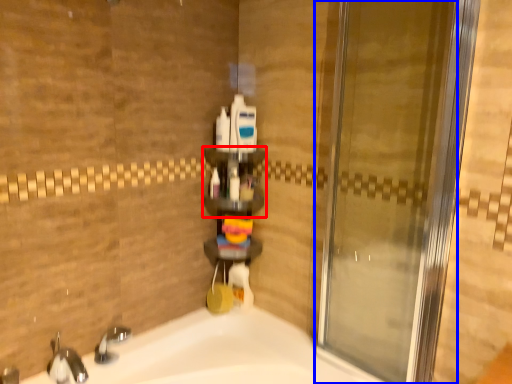
Question: Which object appears farthest to the camera in this image, shelf (highlighted by a red box) or door (highlighted by a blue box)?

Choices:
 (A) shelf
 (B) door

Answer: (A)